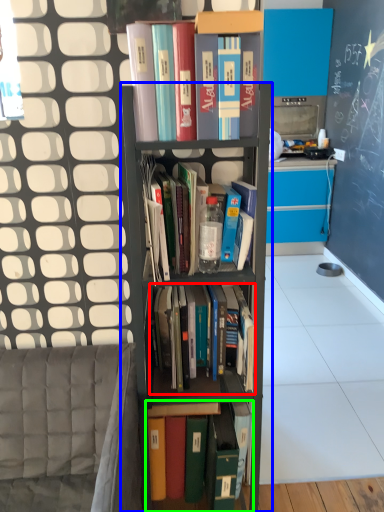
Question: Which is nearer to the book (highlighted by a red box)? shelf (highlighted by a blue box) or book (highlighted by a green box).

Choices:
 (A) shelf
 (B) book

Answer: (A)